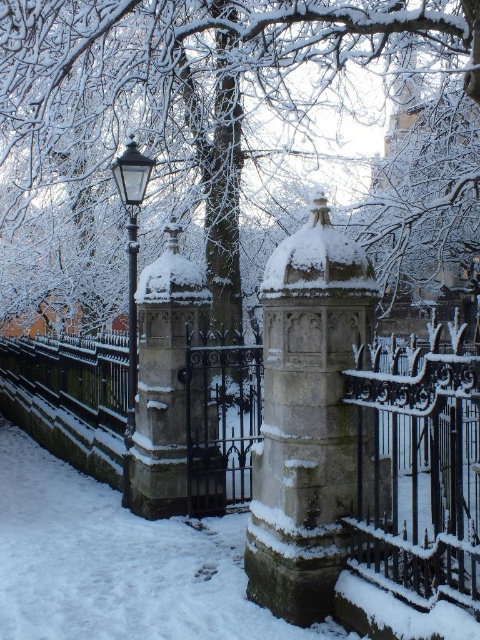
Question: Is snow-covered tree at center further to the viewer compared to stone textured fence at center?

Choices:
 (A) no
 (B) yes

Answer: (B)

Question: Estimate the real-world distances between objects in this image. Which object is closer to the stone textured fence at center?

Choices:
 (A) snow-covered tree at center
 (B) black glass lamp post at left

Answer: (A)

Question: Which of these objects is positioned closest to the snow-covered tree at center?

Choices:
 (A) black glass lamp post at left
 (B) stone textured fence at center

Answer: (B)

Question: In this image, where is stone textured fence at center located relative to black glass lamp post at left?

Choices:
 (A) above
 (B) below

Answer: (B)

Question: Which of the following is the farthest from the observer?

Choices:
 (A) (238, 20)
 (B) (123, 184)
 (C) (227, 385)

Answer: (A)

Question: Does snow-covered tree at center have a smaller size compared to black glass lamp post at left?

Choices:
 (A) no
 (B) yes

Answer: (A)